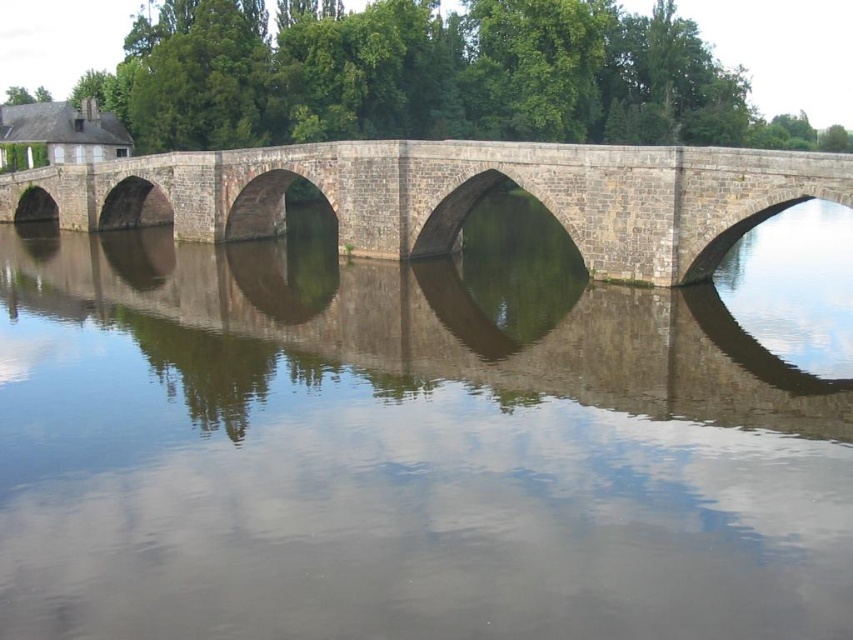
You are standing on the stone bridge at center and want to observe the smooth gray water at center. Which direction should you look to see the reflection of the bridge in the water?

Since the smooth gray water at center is closer to the viewer than the stone bridge at center, you should look downward towards the water to see the reflection of the bridge in the smooth gray water at center.